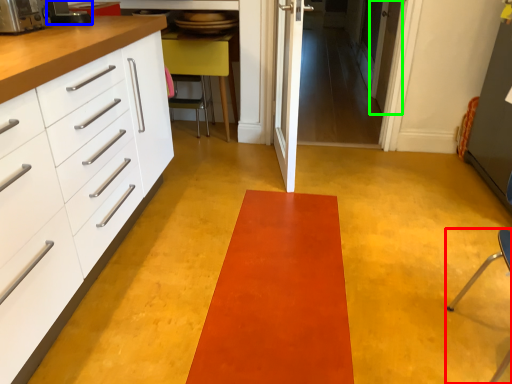
Question: Estimate the real-world distances between objects in this image. Which object is closer to furniture (highlighted by a red box), appliance (highlighted by a blue box) or door (highlighted by a green box)?

Choices:
 (A) appliance
 (B) door

Answer: (B)